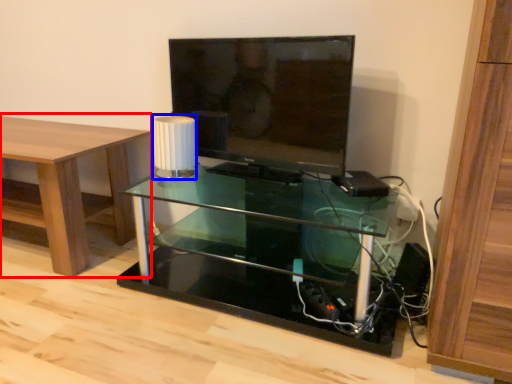
Question: Among these objects, which one is nearest to the camera, table (highlighted by a red box) or lamp (highlighted by a blue box)?

Choices:
 (A) table
 (B) lamp

Answer: (A)